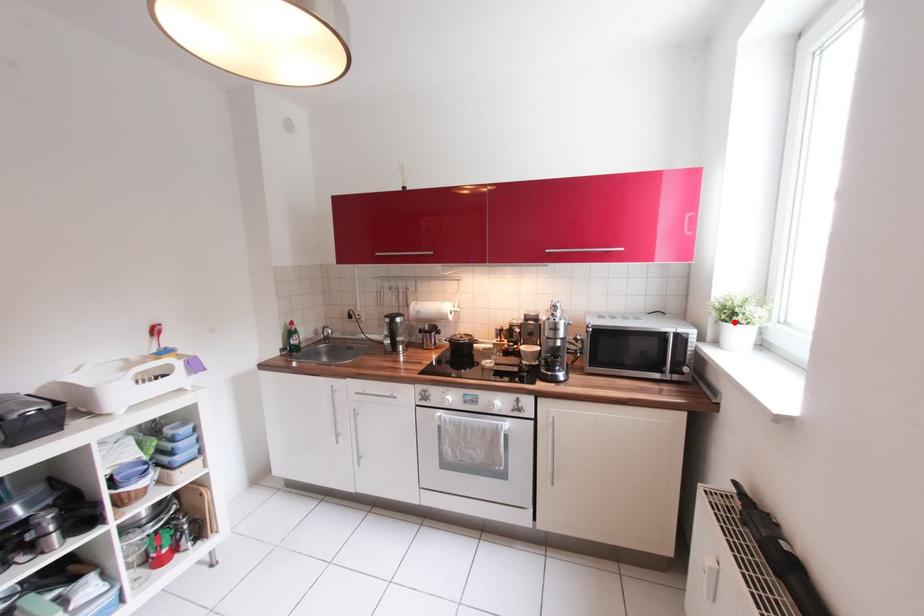
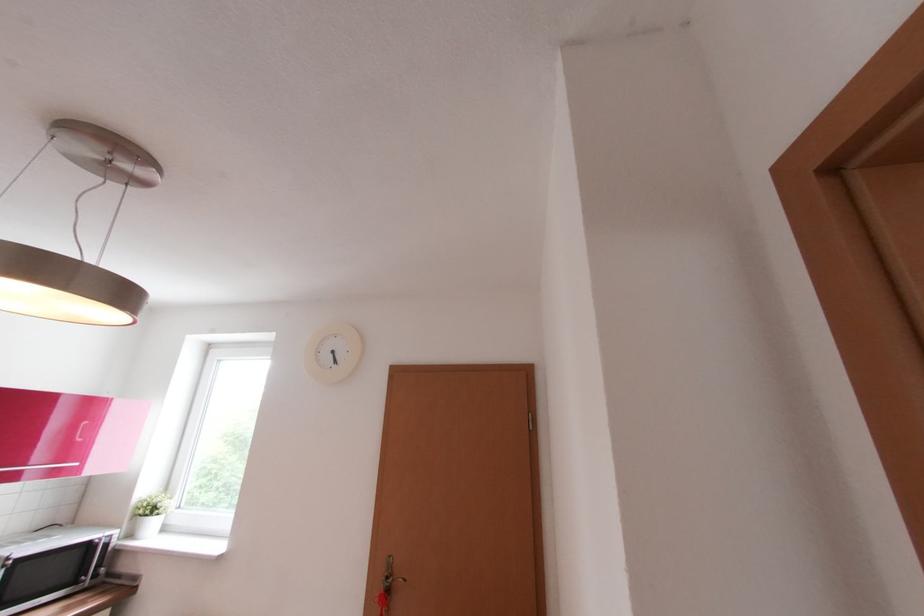
Find the pixel in the second image that matches the highlighted location in the first image.

(155, 516)